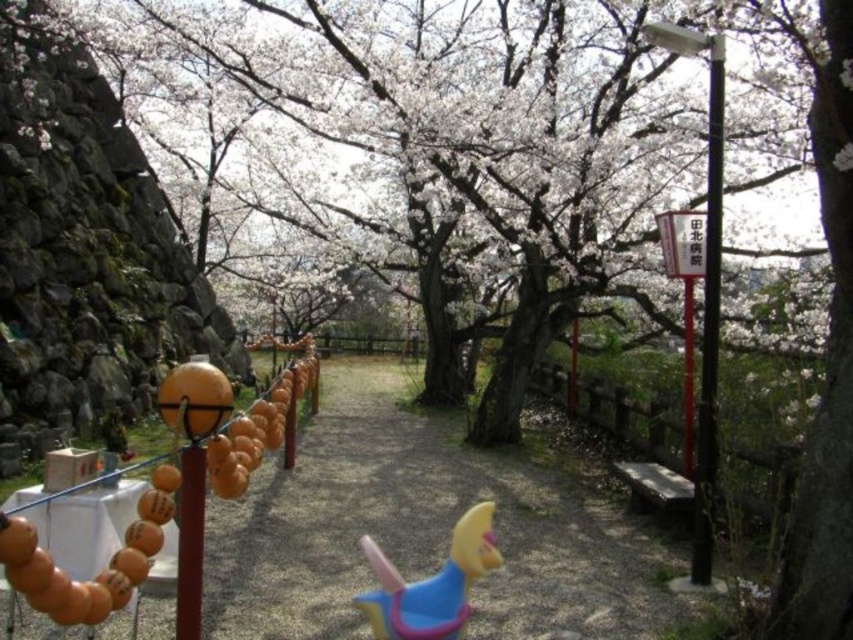
You are standing at the entrance of the pathway and want to walk to the brown gravel path at center. Which direction should you head towards?

You should head towards the center of the image to reach the brown gravel path at center, as it is located at point coordinates of approximately 0.828 on the x axis and 0.508 on the y axis.